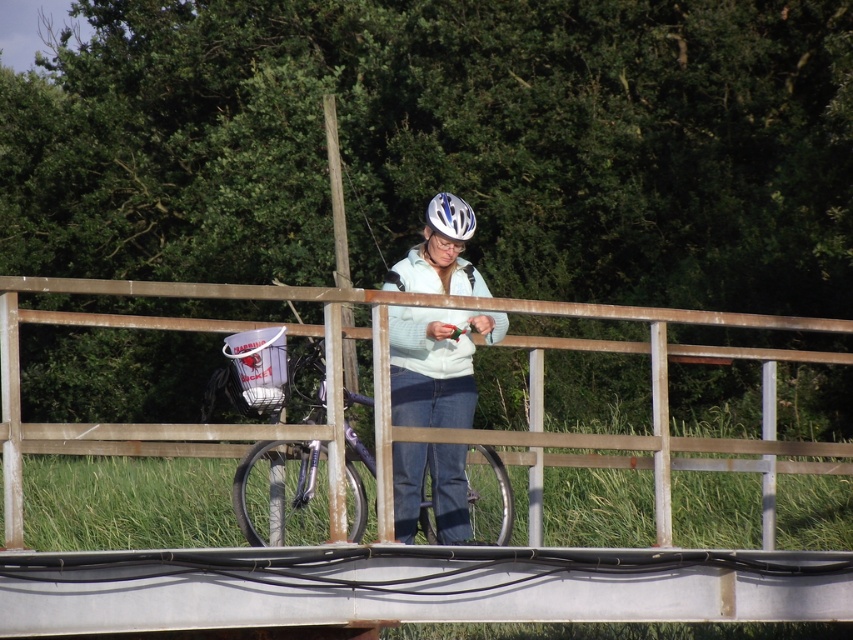
Question: Among these points, which one is farthest from the camera?

Choices:
 (A) (9, 378)
 (B) (408, 358)
 (C) (296, 524)

Answer: (C)

Question: Is brown wooden rail at center positioned behind white matte helmet at center?

Choices:
 (A) no
 (B) yes

Answer: (A)

Question: Where is brown wooden rail at center located in relation to metallic purple bicycle at center in the image?

Choices:
 (A) above
 (B) below

Answer: (A)

Question: Which of the following is the farthest from the observer?

Choices:
 (A) click(x=401, y=458)
 (B) click(x=265, y=502)
 (C) click(x=440, y=305)

Answer: (B)

Question: Does brown wooden rail at center have a larger size compared to white matte helmet at center?

Choices:
 (A) yes
 (B) no

Answer: (B)

Question: Among these objects, which one is nearest to the camera?

Choices:
 (A) metallic purple bicycle at center
 (B) brown wooden rail at center
 (C) white matte helmet at center

Answer: (A)